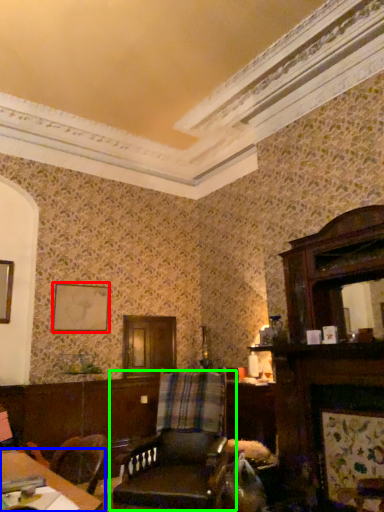
Question: Which object is positioned farthest from picture frame (highlighted by a red box)? Select from table (highlighted by a blue box) and chair (highlighted by a green box).

Choices:
 (A) table
 (B) chair

Answer: (A)